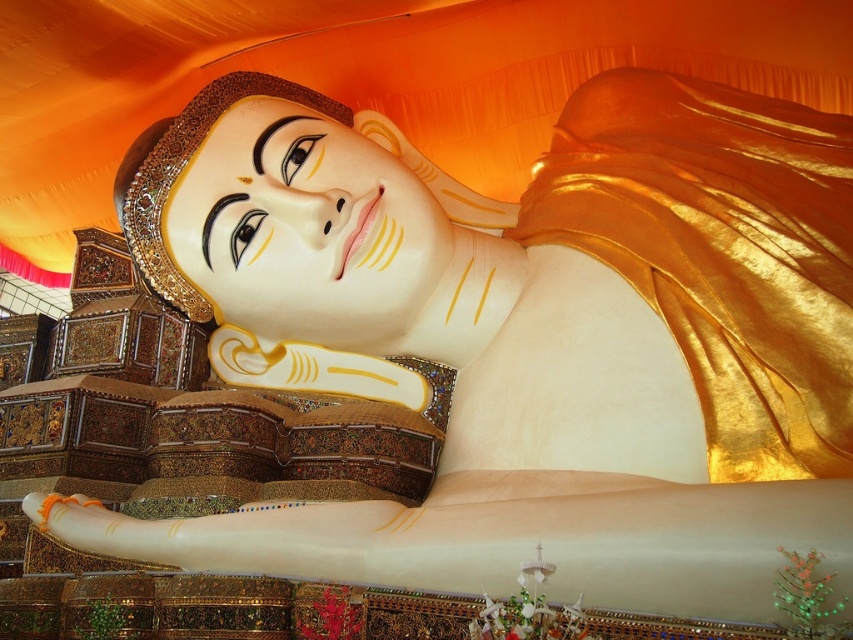
Describe the element at coordinates (720, 252) in the screenshot. Image resolution: width=853 pixels, height=640 pixels. I see `gold shiny cloth at upper right` at that location.

Who is positioned more to the left, gold shiny cloth at upper right or matte gold face at center?

matte gold face at center

Which is in front, point (764, 349) or point (289, 269)?

Point (764, 349)

This screenshot has height=640, width=853. Find the location of `gold shiny cloth at upper right`. gold shiny cloth at upper right is located at coordinates (720, 252).